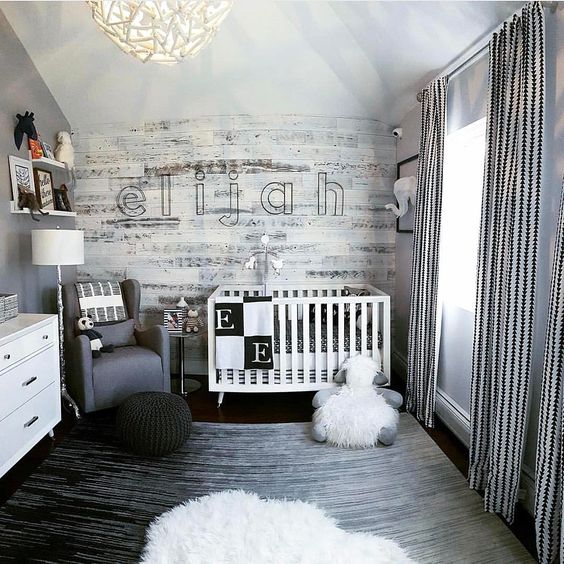
Find the location of a particular element. The image size is (564, 564). lamp is located at coordinates (51, 248).